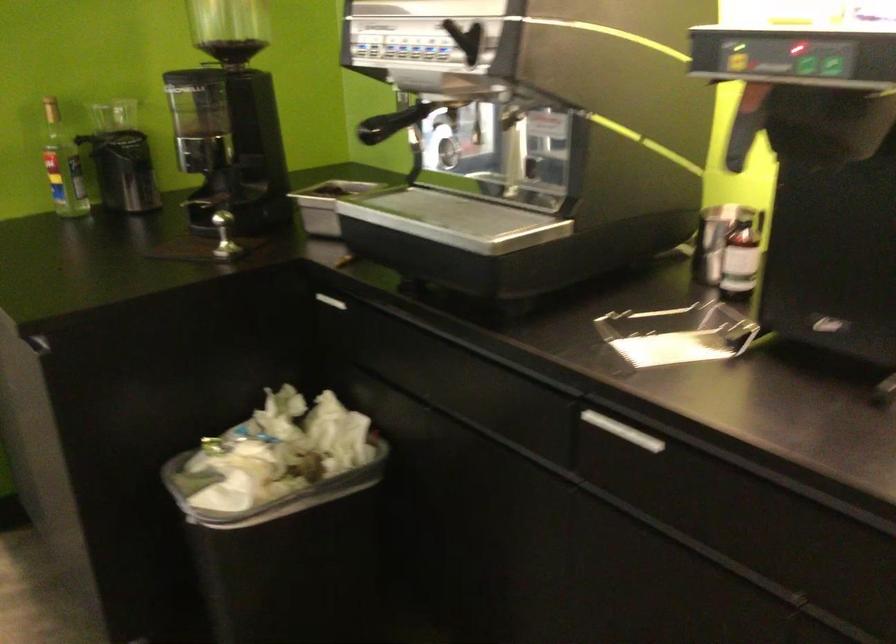
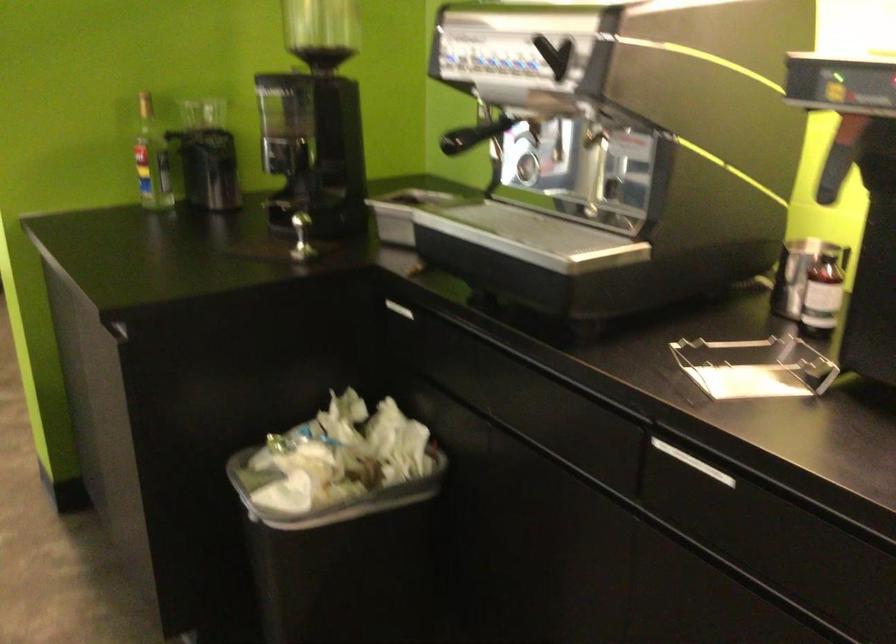
In the second image, find the point that corresponds to [326,299] in the first image.

(394, 308)